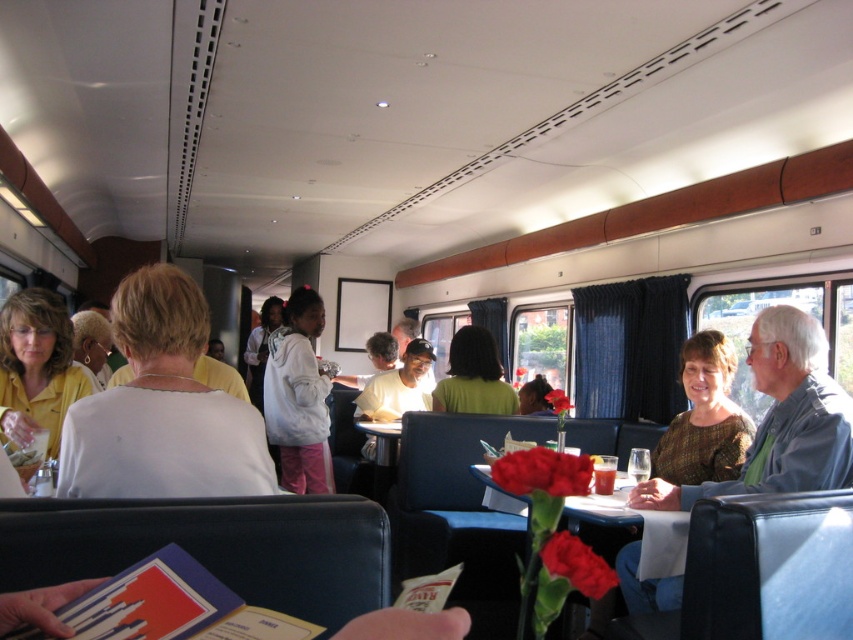
Question: Can you confirm if white matte shirt at center is wider than green matte shirt at center?

Choices:
 (A) yes
 (B) no

Answer: (B)

Question: Can you confirm if white matte shirt at center is thinner than matte black table at center?

Choices:
 (A) yes
 (B) no

Answer: (A)

Question: Is white fleece jacket at center below brown textured dress at lower right?

Choices:
 (A) yes
 (B) no

Answer: (A)

Question: Which object is the farthest from the white fleece jacket at center?

Choices:
 (A) green matte shirt at center
 (B) white matte shirt at center
 (C) brown textured dress at lower right
 (D) matte black table at center

Answer: (B)

Question: Which object appears farthest from the camera in this image?

Choices:
 (A) matte black table at center
 (B) white matte shirt at center
 (C) green matte shirt at center
 (D) brown textured dress at lower right

Answer: (C)

Question: Which of the following is the farthest from the observer?

Choices:
 (A) (791, 451)
 (B) (288, 396)
 (C) (213, 442)

Answer: (B)